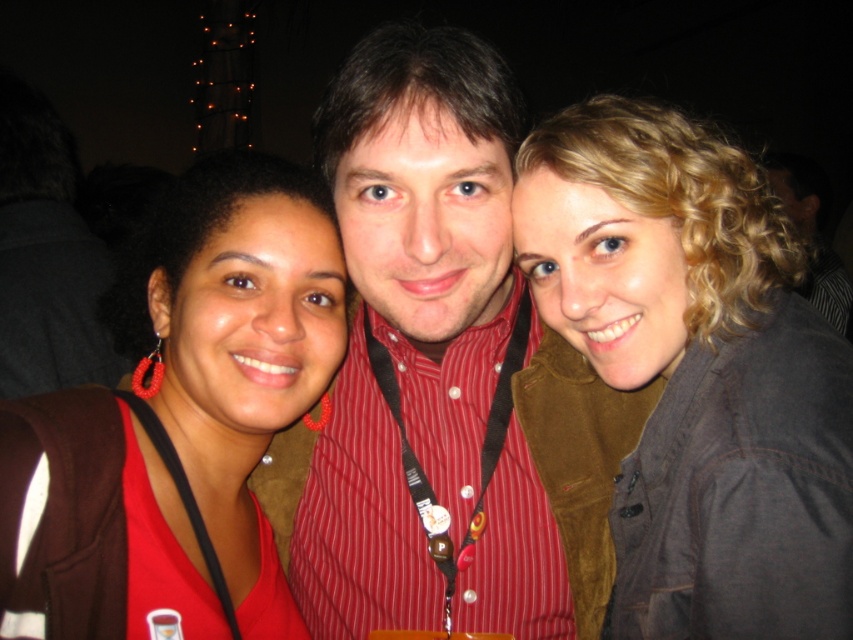
You are a photographer trying to adjust the lighting for a group photo. You notice the blonde curly hair at upper right and the red striped shirt at center. Which of these two has a lower height in the image?

The blonde curly hair at upper right has a lesser height compared to the red striped shirt at center, so it is lower in the image.

You are standing at the camera position and want to take a photo of the group. The photographer has a laser pointer that can reach up to 25 inches. Can the laser pointer reach the point at coordinates point [839,588]?

→ The point at coordinates point [839,588] is 27.92 inches from the camera, which is beyond the laser pointer range of 25 inches. The laser pointer cannot reach it.